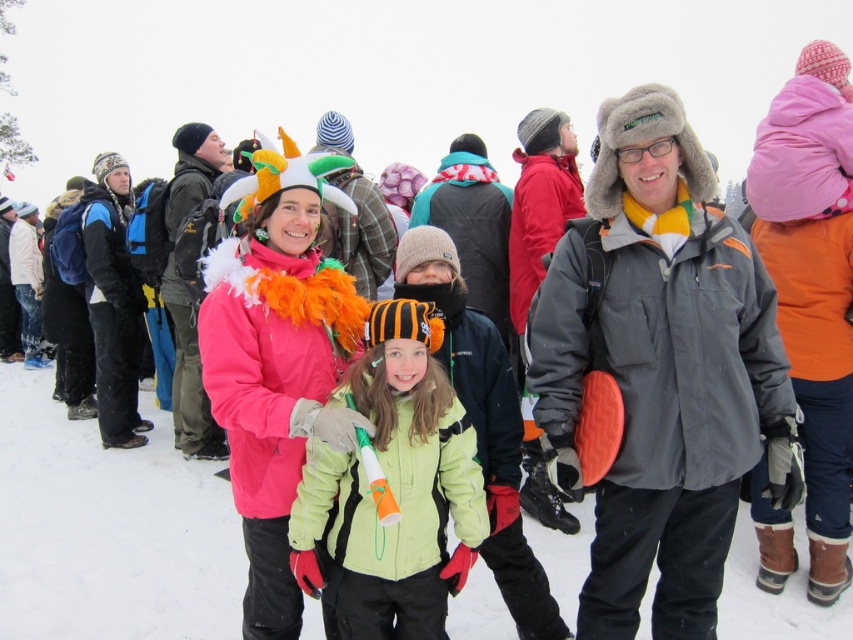
Question: Does gray woolen hat at center have a lesser width compared to matte pink jacket at center?

Choices:
 (A) yes
 (B) no

Answer: (B)

Question: Can you confirm if matte pink jacket at center is bigger than light green fleece jacket at center?

Choices:
 (A) yes
 (B) no

Answer: (A)

Question: Estimate the real-world distances between objects in this image. Which object is closer to the gray woolen hat at center?

Choices:
 (A) matte pink jacket at center
 (B) light green fleece jacket at center

Answer: (B)

Question: Is matte pink jacket at center closer to the viewer compared to light green fleece jacket at center?

Choices:
 (A) no
 (B) yes

Answer: (A)

Question: Which of the following is the closest to the observer?

Choices:
 (A) (383, 401)
 (B) (247, 595)
 (C) (714, 408)

Answer: (C)

Question: Which point is farther to the camera?

Choices:
 (A) light green fleece jacket at center
 (B) gray woolen hat at center

Answer: (B)